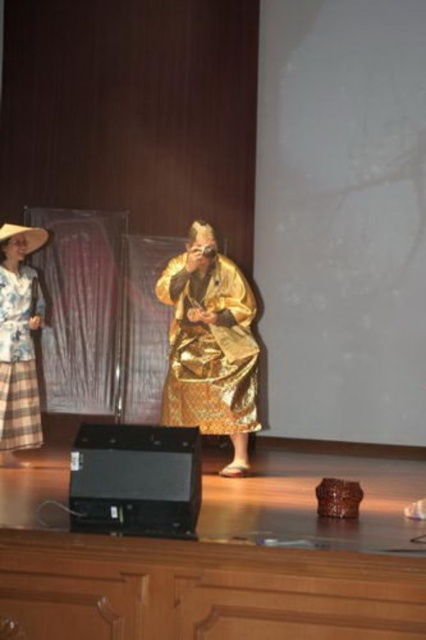
Does gold shiny robe at center have a lesser height compared to matte floral dress at left?

Indeed, gold shiny robe at center has a lesser height compared to matte floral dress at left.

The height and width of the screenshot is (640, 426). What do you see at coordinates (210, 348) in the screenshot?
I see `gold shiny robe at center` at bounding box center [210, 348].

You are a GUI agent. You are given a task and a screenshot of the screen. Output one action in this format:
    pyautogui.click(x=<x>, y=<y>)
    Task: Click on the gold shiny robe at center
    The image size is (426, 640).
    Given the screenshot: What is the action you would take?
    pyautogui.click(x=210, y=348)